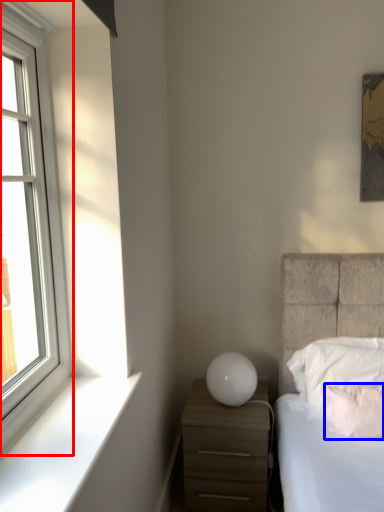
Question: Which point is closer to the camera, window (highlighted by a red box) or pillow (highlighted by a blue box)?

Choices:
 (A) window
 (B) pillow

Answer: (A)